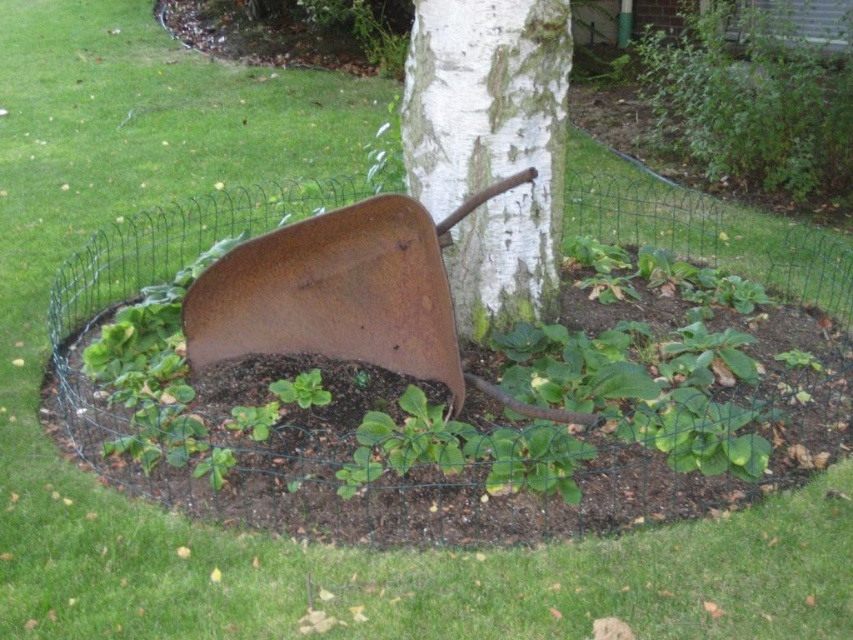
Does point (531, 195) come closer to viewer compared to point (310, 305)?

That is False.

Does white rough bark tree at center have a greater width compared to rusty metal shovel at center?

Incorrect, white rough bark tree at center's width does not surpass rusty metal shovel at center's.

I want to click on white rough bark tree at center, so click(x=490, y=147).